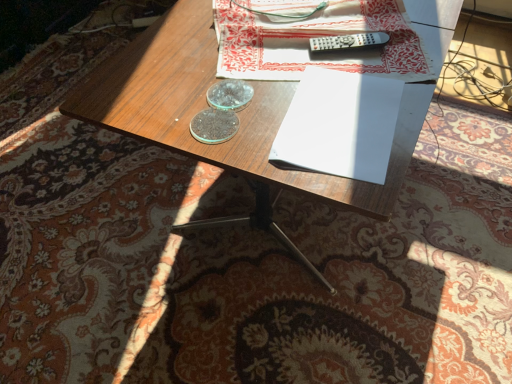
Where is `vacant space to the left of white paper at center`? Image resolution: width=512 pixels, height=384 pixels. vacant space to the left of white paper at center is located at coordinates (234, 113).